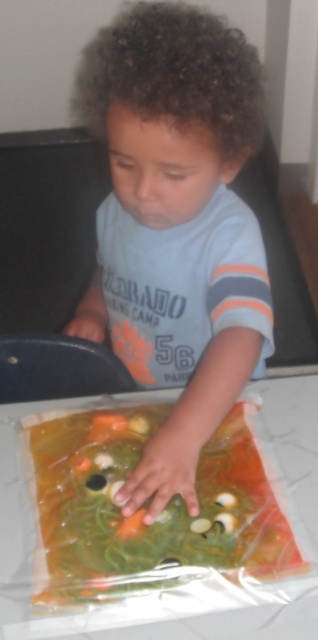
You are a teacher observing a child interacting with a sensory bag. The child is wearing a matte blue shirt at center and has a translucent plastic bag at center. Based on the scene, which object is covering the other?

The matte blue shirt at center is positioned over the translucent plastic bag at center, so the shirt is covering the bag.

You are a photographer trying to capture the child and the plastic bag in the scene. Since the matte blue shirt at center is to the right of the translucent plastic bag at center, where should you position the main light source to highlight both the shirt and the bag effectively?

To highlight both the matte blue shirt at center and the translucent plastic bag at center, position the main light source to the left of the scene. This way, the light will hit the shirt on the right and illuminate the bag from the left, ensuring both elements are well lit.

Where is the matte blue shirt at center located in the image?

The matte blue shirt at center is located at point (178,228).